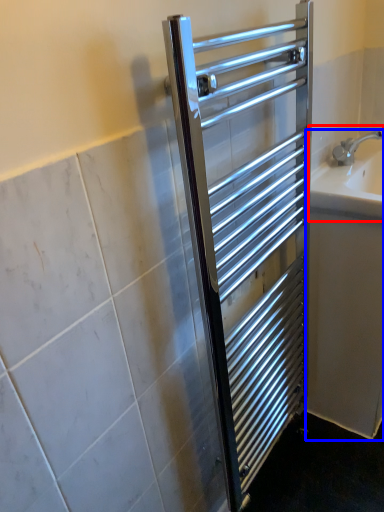
Question: Which of the following is the farthest to the observer, sink (highlighted by a red box) or bath (highlighted by a blue box)?

Choices:
 (A) sink
 (B) bath

Answer: (B)